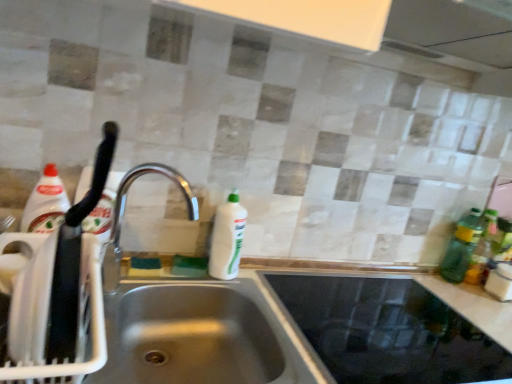
Question: Considering the relative sizes of silver metallic faucet at center and green plastic bottle at right, arranged as the 2th bottle when viewed from the left, in the image provided, is silver metallic faucet at center thinner than green plastic bottle at right, arranged as the 2th bottle when viewed from the left,?

Choices:
 (A) no
 (B) yes

Answer: (A)

Question: Is silver metallic faucet at center completely or partially outside of green plastic bottle at right, arranged as the 2th bottle when viewed from the left?

Choices:
 (A) yes
 (B) no

Answer: (A)

Question: Is the position of silver metallic faucet at center more distant than that of green plastic bottle at right, arranged as the 2th bottle when viewed from the left?

Choices:
 (A) yes
 (B) no

Answer: (B)

Question: Are silver metallic faucet at center and green plastic bottle at right, arranged as the 2th bottle when viewed from the left, located far from each other?

Choices:
 (A) yes
 (B) no

Answer: (A)

Question: Is the position of silver metallic faucet at center less distant than that of green plastic bottle at right, arranged as the 1th bottle when viewed from the right?

Choices:
 (A) no
 (B) yes

Answer: (B)

Question: From the image's perspective, relative to satin steel sink at center, is green plastic bottle at right, arranged as the 2th bottle when viewed from the left, above or below?

Choices:
 (A) above
 (B) below

Answer: (A)

Question: Considering the relative positions of green plastic bottle at right, arranged as the 2th bottle when viewed from the left, and satin steel sink at center in the image provided, is green plastic bottle at right, arranged as the 2th bottle when viewed from the left, to the left or to the right of satin steel sink at center?

Choices:
 (A) left
 (B) right

Answer: (B)

Question: Considering the positions of green plastic bottle at right, arranged as the 1th bottle when viewed from the right, and satin steel sink at center in the image, is green plastic bottle at right, arranged as the 1th bottle when viewed from the right, bigger or smaller than satin steel sink at center?

Choices:
 (A) big
 (B) small

Answer: (B)

Question: Considering the positions of green plastic bottle at right, arranged as the 2th bottle when viewed from the left, and satin steel sink at center in the image, is green plastic bottle at right, arranged as the 2th bottle when viewed from the left, taller or shorter than satin steel sink at center?

Choices:
 (A) tall
 (B) short

Answer: (B)

Question: In the image, is stainless steel sink at lower left on the left side or the right side of silver metallic faucet at center?

Choices:
 (A) left
 (B) right

Answer: (B)

Question: Does point (169, 360) appear closer or farther from the camera than point (113, 230)?

Choices:
 (A) closer
 (B) farther

Answer: (A)

Question: Is stainless steel sink at lower left inside the boundaries of silver metallic faucet at center, or outside?

Choices:
 (A) outside
 (B) inside

Answer: (A)

Question: From a real-world perspective, is stainless steel sink at lower left positioned above or below silver metallic faucet at center?

Choices:
 (A) below
 (B) above

Answer: (A)

Question: Looking at the image, does green translucent bottle at right, positioned as the 1th bottle in left-to-right order, seem bigger or smaller compared to stainless steel sink at lower left?

Choices:
 (A) big
 (B) small

Answer: (B)

Question: In terms of height, does green translucent bottle at right, positioned as the 1th bottle in left-to-right order, look taller or shorter compared to stainless steel sink at lower left?

Choices:
 (A) tall
 (B) short

Answer: (A)